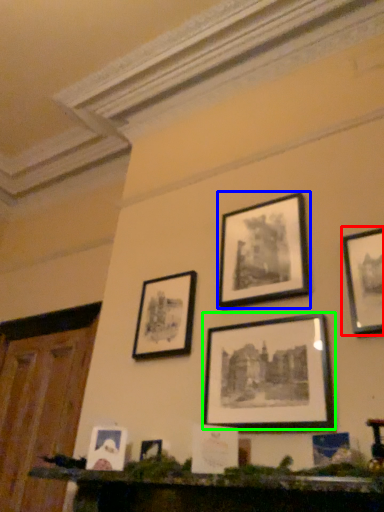
Question: Considering the real-world distances, which object is farthest from picture frame (highlighted by a red box)? picture frame (highlighted by a blue box) or picture frame (highlighted by a green box)?

Choices:
 (A) picture frame
 (B) picture frame

Answer: (A)